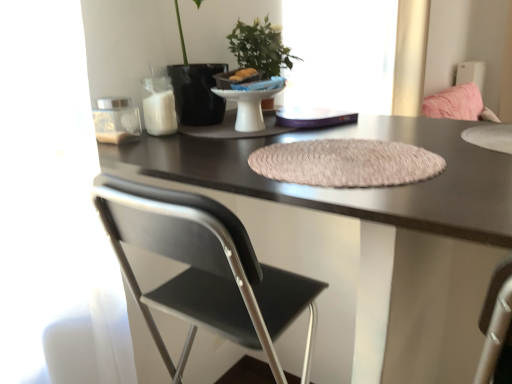
Question: Is transparent glass window at upper center not close to beige textured placemat at center?

Choices:
 (A) yes
 (B) no

Answer: (A)

Question: Does transparent glass window at upper center have a lesser width compared to beige textured placemat at center?

Choices:
 (A) no
 (B) yes

Answer: (B)

Question: Considering the relative sizes of transparent glass window at upper center and beige textured placemat at center in the image provided, is transparent glass window at upper center bigger than beige textured placemat at center?

Choices:
 (A) no
 (B) yes

Answer: (B)

Question: Is the position of transparent glass window at upper center more distant than that of beige textured placemat at center?

Choices:
 (A) no
 (B) yes

Answer: (B)

Question: From a real-world perspective, is transparent glass window at upper center positioned under beige textured placemat at center based on gravity?

Choices:
 (A) yes
 (B) no

Answer: (B)

Question: Looking at their shapes, would you say matte black desk at center is wider or thinner than transparent glass window at upper center?

Choices:
 (A) thin
 (B) wide

Answer: (B)

Question: From the image's perspective, relative to transparent glass window at upper center, is matte black desk at center above or below?

Choices:
 (A) above
 (B) below

Answer: (B)

Question: In terms of height, does matte black desk at center look taller or shorter compared to transparent glass window at upper center?

Choices:
 (A) tall
 (B) short

Answer: (A)

Question: Considering the relative positions of matte black desk at center and transparent glass window at upper center in the image provided, is matte black desk at center to the left or to the right of transparent glass window at upper center?

Choices:
 (A) right
 (B) left

Answer: (B)

Question: Is black matte chair at center taller or shorter than beige textured placemat at center?

Choices:
 (A) tall
 (B) short

Answer: (A)

Question: Considering the positions of black matte chair at center and beige textured placemat at center in the image, is black matte chair at center bigger or smaller than beige textured placemat at center?

Choices:
 (A) big
 (B) small

Answer: (A)

Question: Which is correct: black matte chair at center is inside beige textured placemat at center, or outside of it?

Choices:
 (A) outside
 (B) inside

Answer: (A)

Question: From the image's perspective, is black matte chair at center located above or below beige textured placemat at center?

Choices:
 (A) below
 (B) above

Answer: (A)

Question: Which is correct: matte black desk at center is inside black matte chair at center, or outside of it?

Choices:
 (A) outside
 (B) inside

Answer: (A)

Question: Looking at their shapes, would you say matte black desk at center is wider or thinner than black matte chair at center?

Choices:
 (A) wide
 (B) thin

Answer: (A)